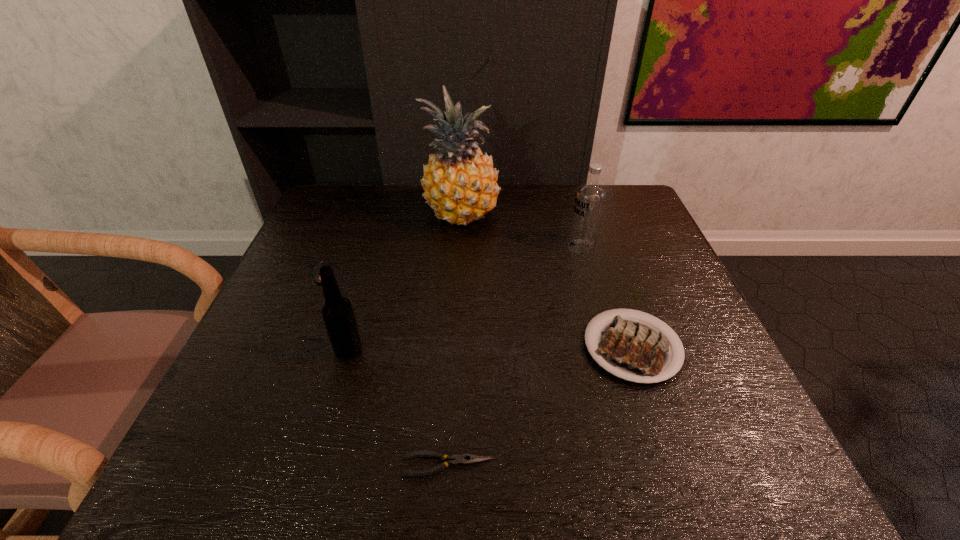
Where is `object positioned at the right edge`? The height and width of the screenshot is (540, 960). object positioned at the right edge is located at coordinates (631, 349).

Where is `free space at the far edge of the desktop`? The image size is (960, 540). free space at the far edge of the desktop is located at coordinates (389, 200).

The width and height of the screenshot is (960, 540). I want to click on vacant region at the near edge of the desktop, so click(478, 471).

Find the location of `blank space at the left edge of the desktop`. blank space at the left edge of the desktop is located at coordinates (275, 353).

Locate an element on the screen. Image resolution: width=960 pixels, height=540 pixels. free space at the right edge is located at coordinates (631, 238).

Where is `free space at the far left corner of the desktop`? This screenshot has height=540, width=960. free space at the far left corner of the desktop is located at coordinates (372, 194).

The height and width of the screenshot is (540, 960). I want to click on vacant space at the far right corner of the desktop, so click(609, 185).

I want to click on blank region between the leftmost object and the shortest object, so [386, 368].

Where is `free space between the leftmost object and the vodka`? free space between the leftmost object and the vodka is located at coordinates (452, 260).

Where is `vacant point located between the fourth nearest object and the second farthest object`? vacant point located between the fourth nearest object and the second farthest object is located at coordinates (452, 260).